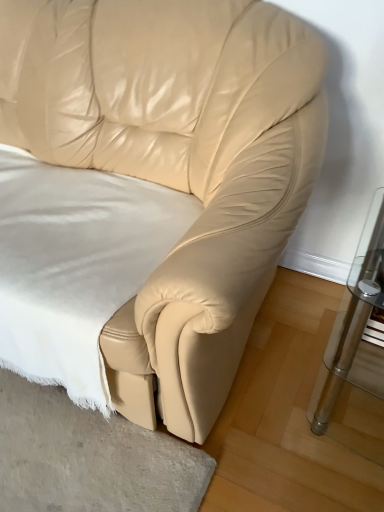
Locate an element on the screen. This screenshot has width=384, height=512. clear glass table at right is located at coordinates (358, 323).

Image resolution: width=384 pixels, height=512 pixels. Describe the element at coordinates (358, 323) in the screenshot. I see `clear glass table at right` at that location.

What do you see at coordinates (75, 264) in the screenshot? I see `white soft fabric at center` at bounding box center [75, 264].

You are a GUI agent. You are given a task and a screenshot of the screen. Output one action in this format:
    pyautogui.click(x=<x>, y=<y>)
    Task: Click on the white soft fabric at center
    The image size is (384, 512).
    Given the screenshot: What is the action you would take?
    pyautogui.click(x=75, y=264)

What is the approximate width of white soft fabric at center?

The width of white soft fabric at center is 61.56 centimeters.

Where is `clear glass table at right`? The height and width of the screenshot is (512, 384). clear glass table at right is located at coordinates (358, 323).

Between clear glass table at right and white soft fabric at center, which one appears on the right side from the viewer's perspective?

clear glass table at right.

Considering the positions of objects clear glass table at right and white soft fabric at center in the image provided, who is in front, clear glass table at right or white soft fabric at center?

clear glass table at right is in front.

Considering the positions of point (369, 298) and point (111, 208), is point (369, 298) closer or farther from the camera than point (111, 208)?

Clearly, point (369, 298) is closer to the camera than point (111, 208).

From the image's perspective, between clear glass table at right and white soft fabric at center, which one is located above?

From the image's view, white soft fabric at center is above.

From a real-world perspective, is clear glass table at right over white soft fabric at center?

No, from a real-world perspective, clear glass table at right is not on top of white soft fabric at center.

Considering the sizes of clear glass table at right and white soft fabric at center in the image, is clear glass table at right wider or thinner than white soft fabric at center?

Clearly, clear glass table at right has less width compared to white soft fabric at center.

Consider the image. Considering the sizes of clear glass table at right and white soft fabric at center in the image, is clear glass table at right taller or shorter than white soft fabric at center?

Clearly, clear glass table at right is taller compared to white soft fabric at center.

Which of these two, clear glass table at right or white soft fabric at center, is smaller?

clear glass table at right.

Is white soft fabric at center completely or partially inside clear glass table at right?

Definitely not — white soft fabric at center is not inside clear glass table at right.

Would you say clear glass table at right is a long distance from white soft fabric at center?

clear glass table at right is actually quite close to white soft fabric at center.

Is clear glass table at right oriented towards white soft fabric at center?

No, clear glass table at right is not facing towards white soft fabric at center.

Image resolution: width=384 pixels, height=512 pixels. In order to click on table below the white soft fabric at center (from a real-world perspective) in this screenshot , I will do `click(358, 323)`.

Looking at this image, does white soft fabric at center appear on the right side of clear glass table at right?

No.

Is white soft fabric at center behind clear glass table at right?

Yes, white soft fabric at center is behind clear glass table at right.

Does point (8, 253) come in front of point (379, 279)?

No, it is not.

From the image's perspective, is white soft fabric at center under clear glass table at right?

No.

From a real-world perspective, which object rests below the other?

clear glass table at right.

Looking at their sizes, would you say white soft fabric at center is wider or thinner than clear glass table at right?

In the image, white soft fabric at center appears to be wider than clear glass table at right.

Is white soft fabric at center taller or shorter than clear glass table at right?

Clearly, white soft fabric at center is shorter compared to clear glass table at right.

Considering the relative sizes of white soft fabric at center and clear glass table at right in the image provided, is white soft fabric at center smaller than clear glass table at right?

No.

Is white soft fabric at center located outside clear glass table at right?

That's correct, white soft fabric at center is outside of clear glass table at right.

Are white soft fabric at center and clear glass table at right beside each other?

No, white soft fabric at center is not in contact with clear glass table at right.

Could you tell me if white soft fabric at center is turned towards clear glass table at right?

No.

How different are the orientations of white soft fabric at center and clear glass table at right in degrees?

0.957 degrees separate the facing orientations of white soft fabric at center and clear glass table at right.

Find the location of `sheet above the clear glass table at right (from the image's perspective)`. sheet above the clear glass table at right (from the image's perspective) is located at coordinates (75, 264).

Where is `table on the right of white soft fabric at center`? table on the right of white soft fabric at center is located at coordinates (358, 323).

At what (x,y) coordinates should I click in order to perform the action: click on sheet that appears on the left of clear glass table at right. Please return your answer as a coordinate pair (x, y). This screenshot has height=512, width=384. Looking at the image, I should click on (75, 264).